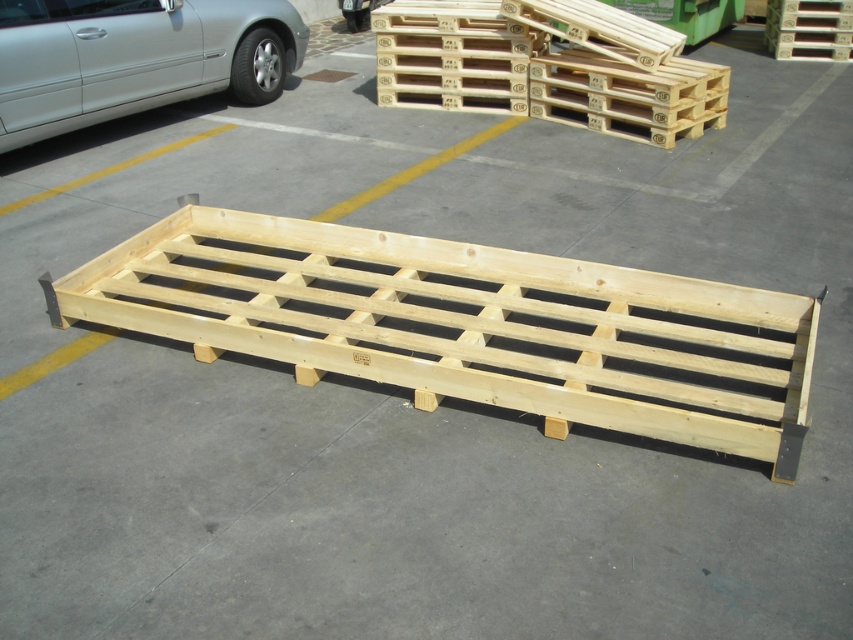
Question: Among these objects, which one is farthest from the camera?

Choices:
 (A) silver metallic car at left
 (B) natural wood pallet at upper right
 (C) natural wood pallet at center
 (D) natural wood pallet at upper center

Answer: (B)

Question: Is natural wood pallet at upper center wider than natural wood pallet at upper right?

Choices:
 (A) yes
 (B) no

Answer: (A)

Question: Estimate the real-world distances between objects in this image. Which object is farther from the natural wood pallet at center?

Choices:
 (A) natural wood pallet at upper center
 (B) silver metallic car at left

Answer: (B)

Question: Does natural wood pallet at center come behind natural wood pallet at upper right?

Choices:
 (A) yes
 (B) no

Answer: (B)

Question: Can you confirm if natural wood pallet at upper center is positioned to the right of natural wood pallet at upper right?

Choices:
 (A) yes
 (B) no

Answer: (B)

Question: Which point is farther from the camera taking this photo?

Choices:
 (A) (21, 8)
 (B) (850, 3)

Answer: (B)